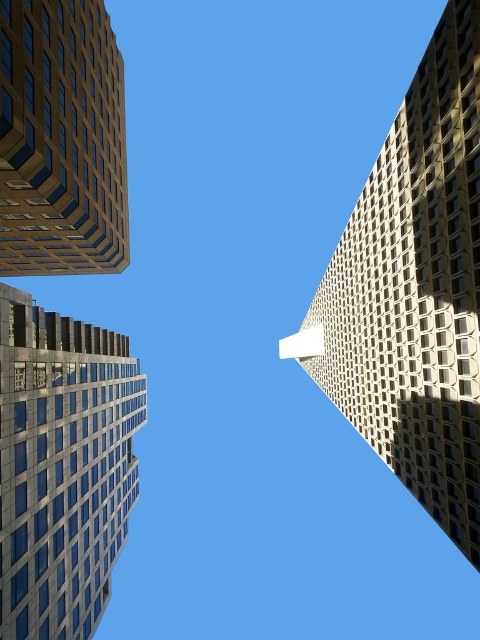
You are an architect analyzing the spatial relationship between the metallic glass skyscraper at center and the matte glass building at upper left. Which building has a smaller width according to the description?

The metallic glass skyscraper at center has a lesser width compared to the matte glass building at upper left, so it is the smaller one in width.

You are standing at the base of the beige textured building at right and want to take a photo of it. There is a lamppost at point 0.5, 0.9. Will the lamppost block your view of the building?

The beige textured building at right is located at point (x=415, y=291), while the lamppost is at (x=432, y=320). Since the lamppost is slightly to the right and above the building, it may partially block the view depending on the camera angle and lens used.

You are an architect analyzing the structural stability of the beige textured building at right and the matte glass building at upper left. Which building has a narrower base to consider for foundation requirements?

The beige textured building at right is thinner than the matte glass building at upper left, so its base is narrower. Therefore, the beige textured building at right requires careful consideration for foundation requirements due to its narrower base.